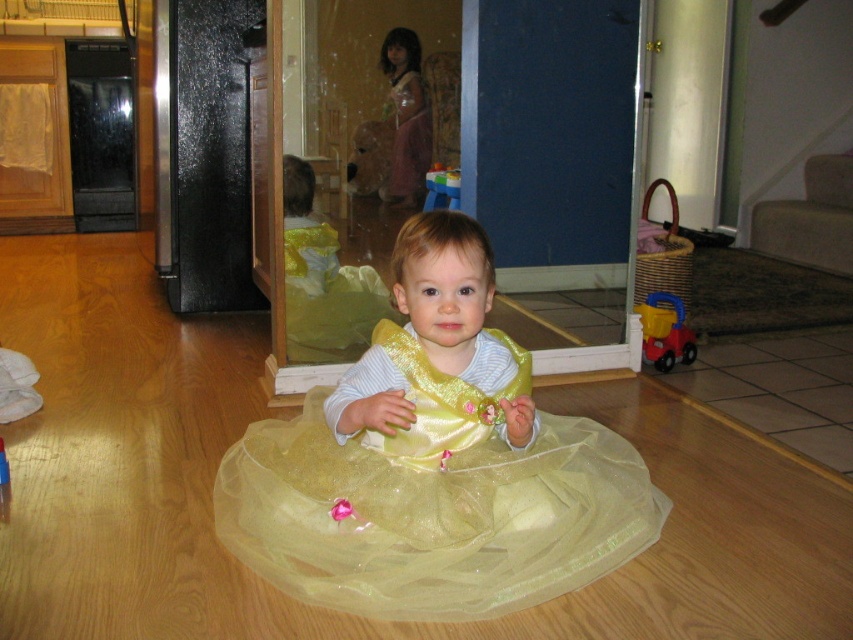
Which of these two, shiny yellow tulle dress at center or matte plastic toy truck at lower right, stands shorter?

With less height is matte plastic toy truck at lower right.

This screenshot has height=640, width=853. What do you see at coordinates (434, 499) in the screenshot?
I see `shiny yellow tulle dress at center` at bounding box center [434, 499].

The width and height of the screenshot is (853, 640). I want to click on shiny yellow tulle dress at center, so click(434, 499).

Between point (444, 186) and point (4, 461), which one is positioned behind?

Point (444, 186)

Which is more to the left, blue plastic toy at center or rubber red toy at center?

From the viewer's perspective, rubber red toy at center appears more on the left side.

Image resolution: width=853 pixels, height=640 pixels. In order to click on blue plastic toy at center in this screenshot , I will do `click(442, 188)`.

Is shiny yellow tulle dress at center closer to camera compared to blue plastic toy at center?

Yes, it is.

Between shiny yellow tulle dress at center and blue plastic toy at center, which one has more height?

shiny yellow tulle dress at center is taller.

Is point (618, 515) less distant than point (438, 192)?

Yes, point (618, 515) is in front of point (438, 192).

This screenshot has height=640, width=853. Find the location of `shiny yellow tulle dress at center`. shiny yellow tulle dress at center is located at coordinates coord(434,499).